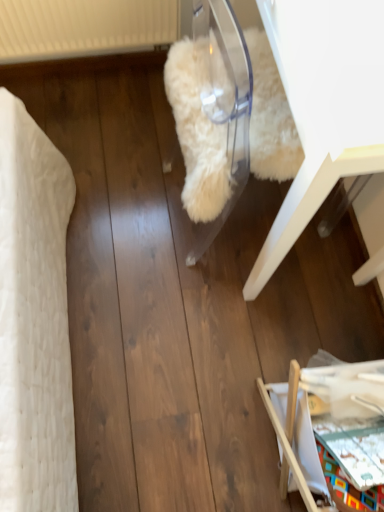
Where is `vacant space that's between white fluffy rug at center, placed as the second furniture when sorted from bottom to top, and wooden folding chair at lower right, marked as the first furniture in a bottom-to-top arrangement`? This screenshot has width=384, height=512. vacant space that's between white fluffy rug at center, placed as the second furniture when sorted from bottom to top, and wooden folding chair at lower right, marked as the first furniture in a bottom-to-top arrangement is located at coordinates (309, 323).